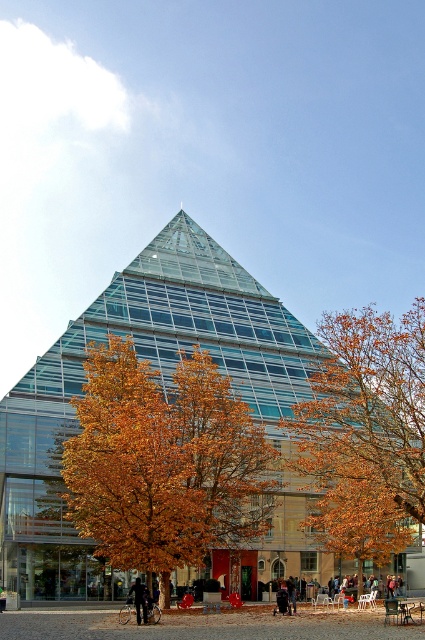
Which of these two, transparent glass pyramid at center or black leather jacket at center, stands taller?

transparent glass pyramid at center

The width and height of the screenshot is (425, 640). Find the location of `transparent glass pyramid at center`. transparent glass pyramid at center is located at coordinates (164, 381).

Is transparent glass pyramid at center to the left of orange leafy tree at center from the viewer's perspective?

Yes, transparent glass pyramid at center is to the left of orange leafy tree at center.

Can you confirm if transparent glass pyramid at center is positioned above orange leafy tree at center?

Actually, transparent glass pyramid at center is below orange leafy tree at center.

Does point (62, 349) lie behind point (374, 328)?

Yes, it is.

The image size is (425, 640). What are the coordinates of `transparent glass pyramid at center` in the screenshot? It's located at (164, 381).

In the scene shown: Is transparent glass pyramid at center below golden leafy tree at center?

No.

Does transparent glass pyramid at center have a smaller size compared to golden leafy tree at center?

Incorrect, transparent glass pyramid at center is not smaller in size than golden leafy tree at center.

Between point (11, 433) and point (260, 529), which one is positioned in front?

Point (11, 433) is in front.

You are a GUI agent. You are given a task and a screenshot of the screen. Output one action in this format:
    pyautogui.click(x=<x>, y=<y>)
    Task: Click on the transparent glass pyramid at center
    This screenshot has height=640, width=425.
    Given the screenshot: What is the action you would take?
    pyautogui.click(x=164, y=381)